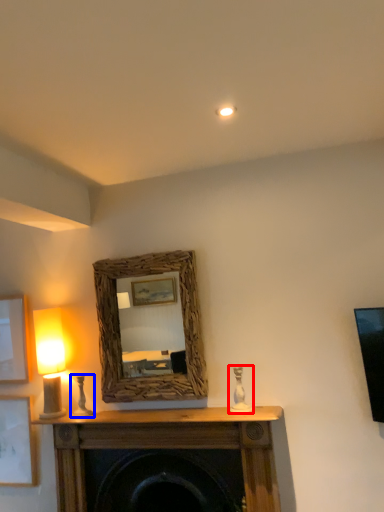
Question: Which object appears farthest to the camera in this image, candle holder (highlighted by a red box) or candle holder (highlighted by a blue box)?

Choices:
 (A) candle holder
 (B) candle holder

Answer: (B)